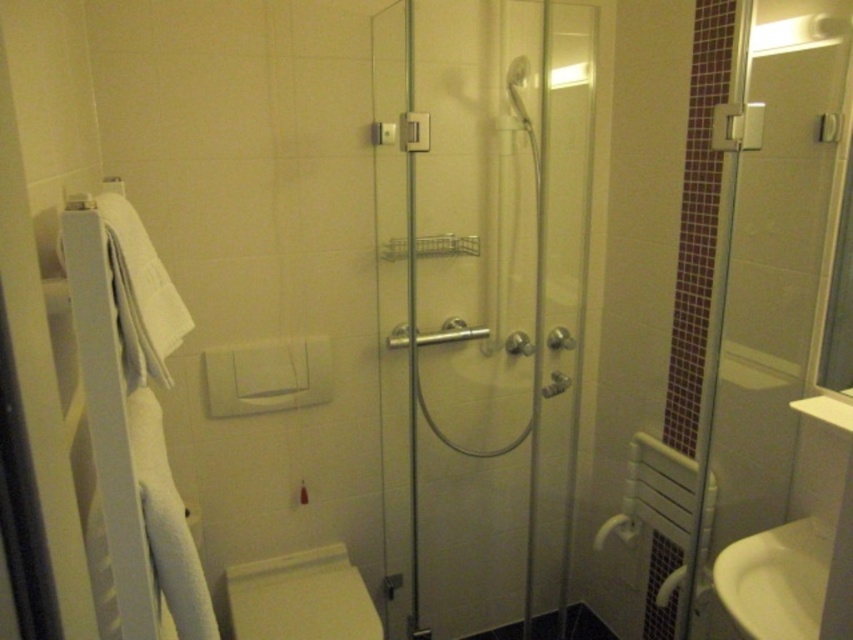
Who is more forward, (491, 252) or (776, 237)?

Positioned in front is point (776, 237).

Does transparent glass shower door at center have a greater height compared to transparent glass shower door at right?

Correct, transparent glass shower door at center is much taller as transparent glass shower door at right.

Is point (570, 550) in front of point (761, 83)?

That is False.

Identify the location of transparent glass shower door at center. (480, 305).

Is point (534, 502) farther from camera compared to point (819, 532)?

Yes, it is behind point (819, 532).

Does point (421, 131) come in front of point (805, 556)?

Yes, point (421, 131) is closer to viewer.

Is point (573, 360) closer to viewer compared to point (750, 596)?

No, (573, 360) is further to viewer.

The image size is (853, 640). In order to click on transparent glass shower door at center in this screenshot , I will do `click(480, 305)`.

Between transparent glass shower door at right and white glossy toilet bowl at lower center, which one is positioned lower?

white glossy toilet bowl at lower center is lower down.

Is transparent glass shower door at right to the left of white glossy toilet bowl at lower center from the viewer's perspective?

No, transparent glass shower door at right is not to the left of white glossy toilet bowl at lower center.

Between point (733, 64) and point (241, 582), which one is positioned in front?

Point (733, 64) is more forward.

Where is `transparent glass shower door at right`? transparent glass shower door at right is located at coordinates (764, 273).